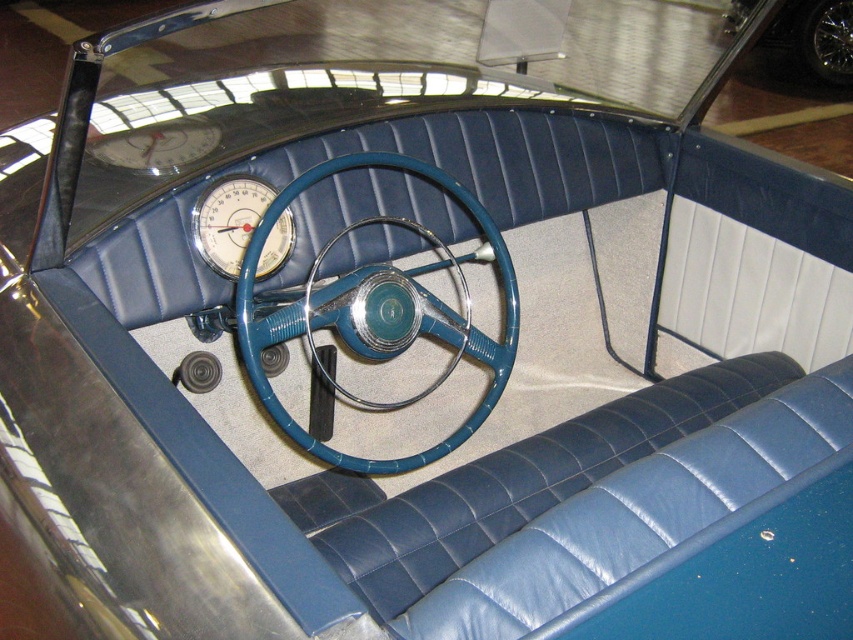
You are sitting in the driver seat of the vintage car and want to reach the blue textured steering wheel at center. Based on its position, can you estimate whether it is positioned closer to the front or the back of the driver seat?

The blue textured steering wheel at center is located at point coordinates approximately 0.494 on the x and 0.441 on the y. Since the coordinates are close to the center of the car interior, it is positioned closer to the front of the driver seat as steering wheels are typically placed in front of the driver.

You are sitting in the driver seat of the vintage car and want to adjust the steering wheel. Which steering wheel do you need to reach towards yourself to adjust? The blue textured steering wheel at center or the blue metallic steering wheel at center?

You need to reach towards the blue textured steering wheel at center because it is closer to you than the blue metallic steering wheel at center.